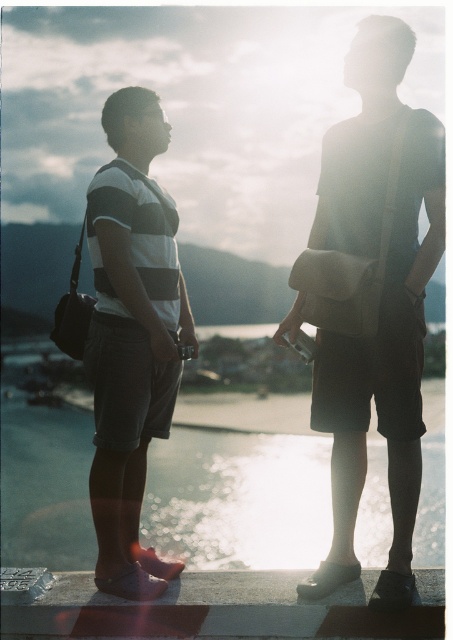
Looking at this image, you are a photographer trying to capture the striped cotton shirt at left and the translucent glass water at center in a single shot. Since the water is under the shirt, will you need to adjust your camera angle to include both?

The translucent glass water at center is positioned under the striped cotton shirt at left, so you will need to adjust your camera angle to include both in the shot.

You are a photographer planning to take a portrait of the two people in the scene. You have a camera with a 50mm lens that has a depth of field that can focus on objects up to 1 meter apart. The translucent glass water at center and the matte beige bag at center are both in the foreground. Will both objects remain in focus if you focus on the person on the left?

The translucent glass water at center has a smaller size compared to the matte beige bag at center, but their distance from the camera isn generated by the user. Please provide the distance between the two objects to determine if they will stay in focus.